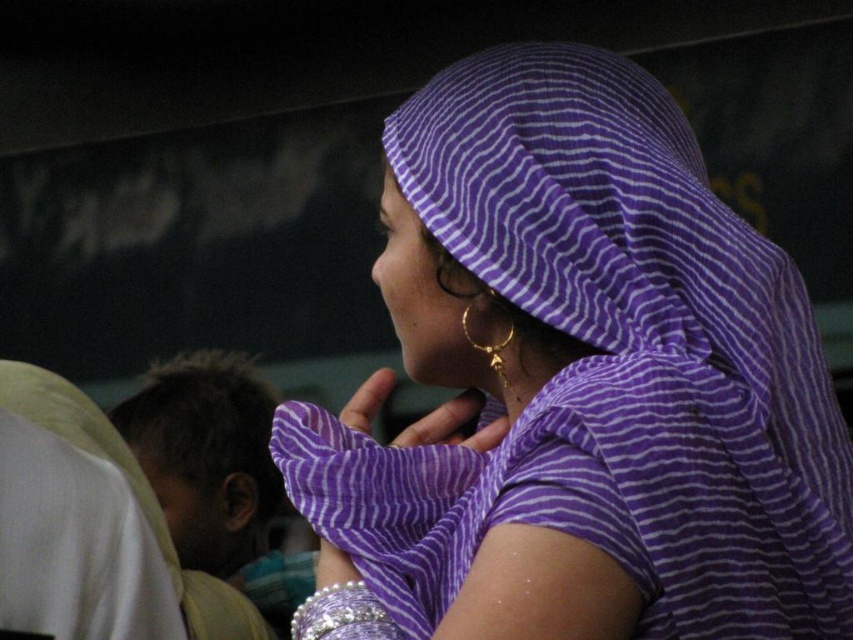
Is purple striped scarf at upper right positioned behind silver metallic bracelet at lower center?

No, purple striped scarf at upper right is in front of silver metallic bracelet at lower center.

Describe the element at coordinates (584, 381) in the screenshot. I see `purple striped scarf at upper right` at that location.

At what (x,y) coordinates should I click in order to perform the action: click on purple striped scarf at upper right. Please return your answer as a coordinate pair (x, y). This screenshot has width=853, height=640. Looking at the image, I should click on (584, 381).

Which is more to the right, goldeffectearring at center or silver metallic bracelet at lower center?

From the viewer's perspective, goldeffectearring at center appears more on the right side.

How distant is goldeffectearring at center from silver metallic bracelet at lower center?

goldeffectearring at center is 8.47 inches away from silver metallic bracelet at lower center.

Who is more forward, [350,420] or [364,593]?

Point [364,593] is in front.

Image resolution: width=853 pixels, height=640 pixels. Find the location of `goldeffectearring at center`. goldeffectearring at center is located at coordinates (454, 424).

Image resolution: width=853 pixels, height=640 pixels. Describe the element at coordinates (584, 381) in the screenshot. I see `purple striped scarf at upper right` at that location.

Between purple striped scarf at upper right and brown hair at left, which one is positioned higher?

purple striped scarf at upper right is higher up.

From the picture: Who is more forward, (469,616) or (187,376)?

Point (469,616) is in front.

Find the location of a particular element. This screenshot has height=640, width=853. purple striped scarf at upper right is located at coordinates (584, 381).